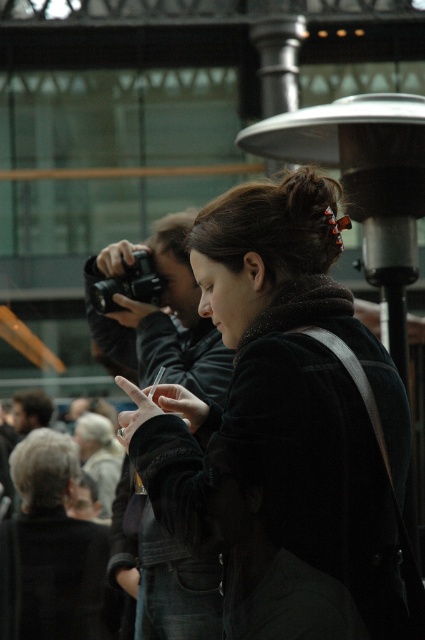
You are a photographer who wants to adjust the focus of your camera. You have two cameras in your view, the matte black camera at center and the black plastic camera at upper left. Which camera should you focus on first if you want to adjust the one that is nearest to you?

The matte black camera at center is closer to the viewer than the black plastic camera at upper left, so you should focus on the matte black camera at center first.

You are standing in the urban setting shown in the image. There are two points marked in the scene. The first point is at coordinates point (189,440) and the second point is at point (141,275). Which of these two points is nearer to you?

Point (189,440) is closer to the viewer than point (141,275).

You are standing in the urban setting shown in the image. You see the dark brown leather jacket at center. Can you tell me the exact coordinates where it is located?

The dark brown leather jacket at center is located at point (282, 426).